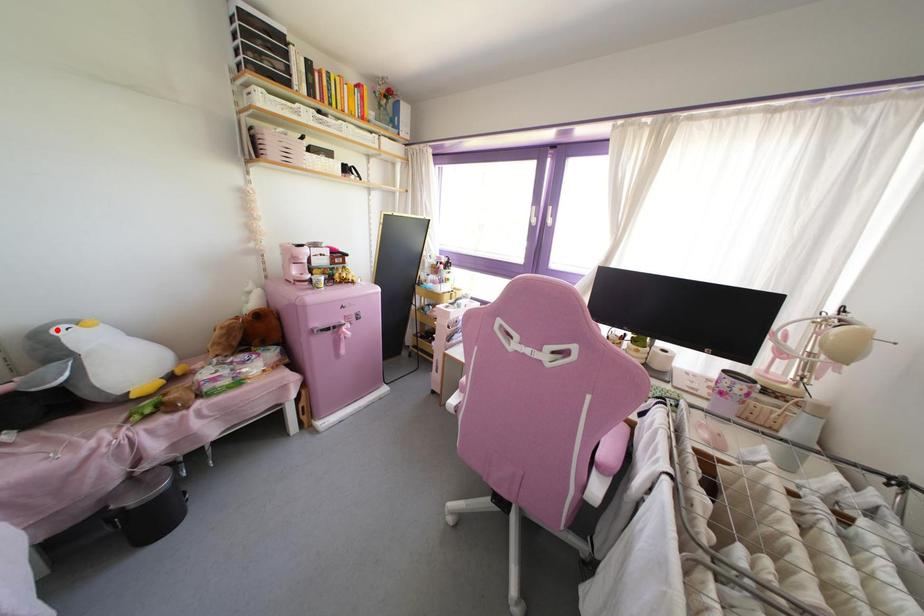
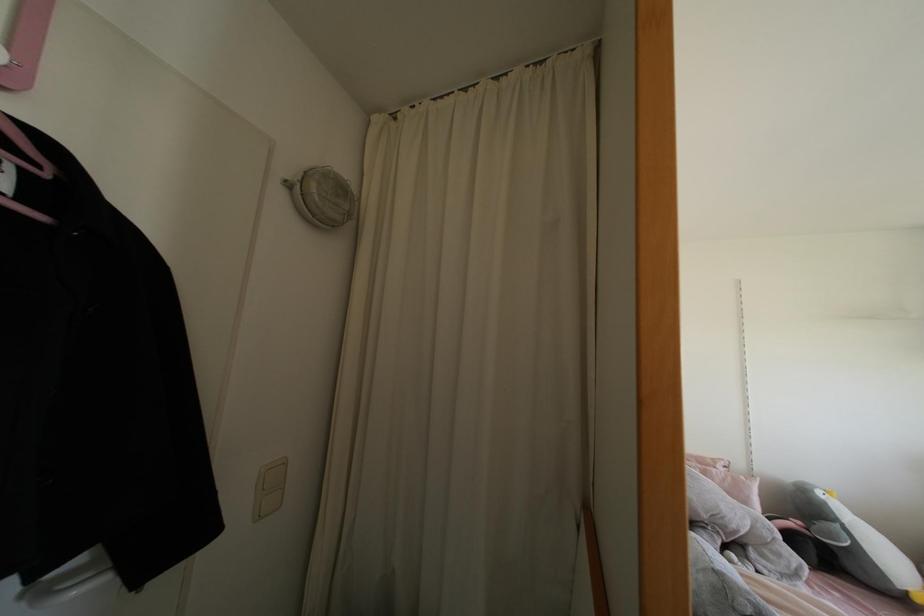
Locate, in the second image, the point that corresponds to the highlighted location in the first image.

(819, 493)